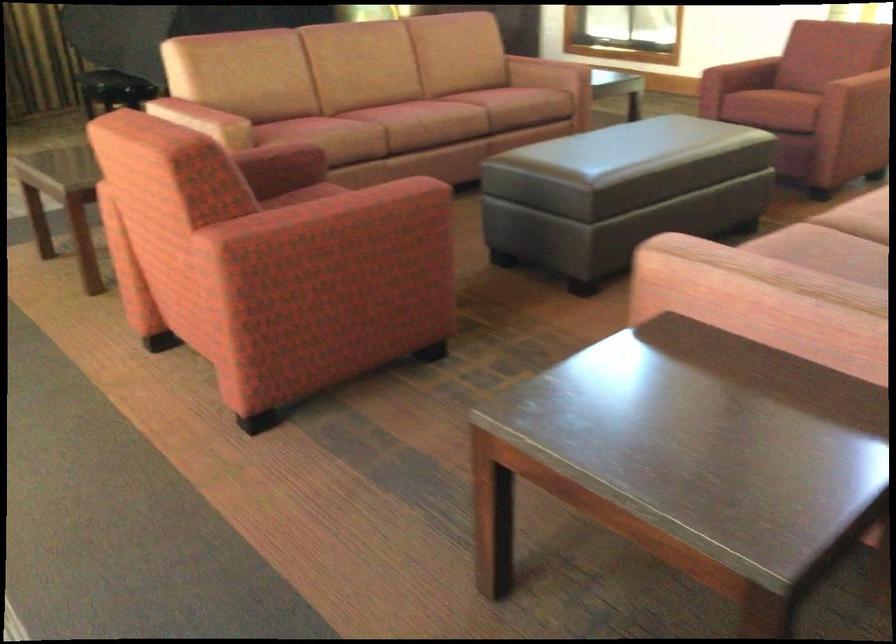
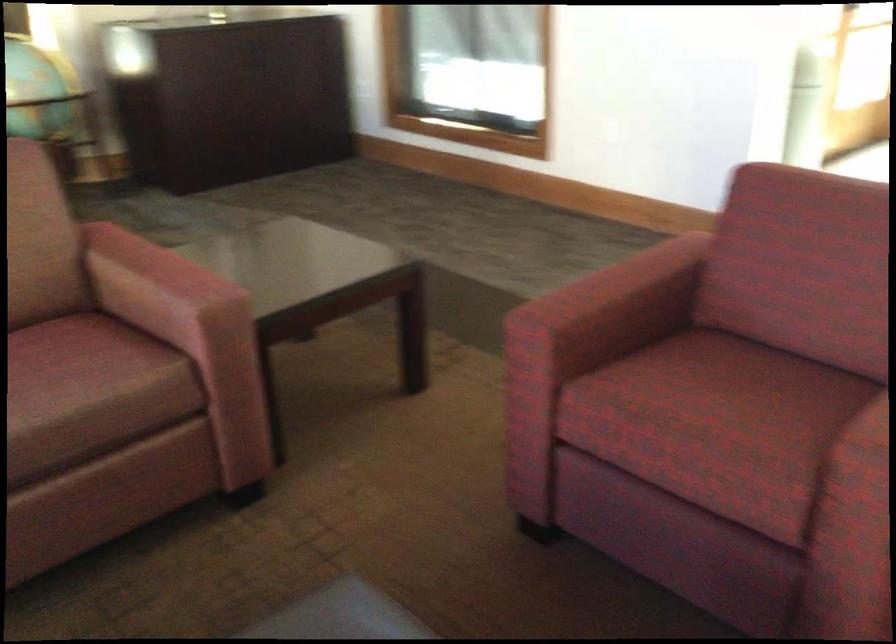
In a continuous first-person perspective shot, in which direction is the camera moving?

The movement direction of the cameraman is right, forward.